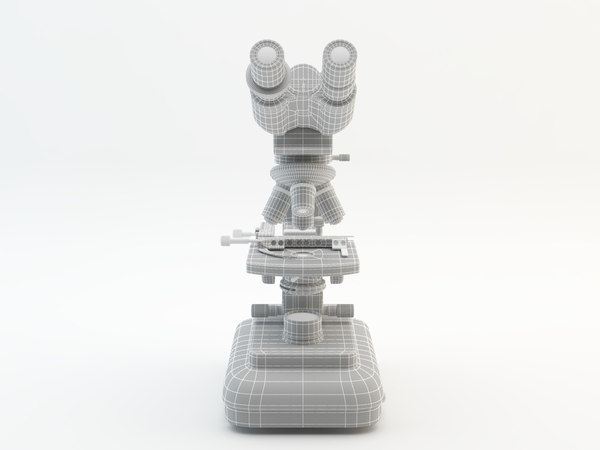
This screenshot has height=450, width=600. I want to click on area to right of microscope, so click(406, 250).